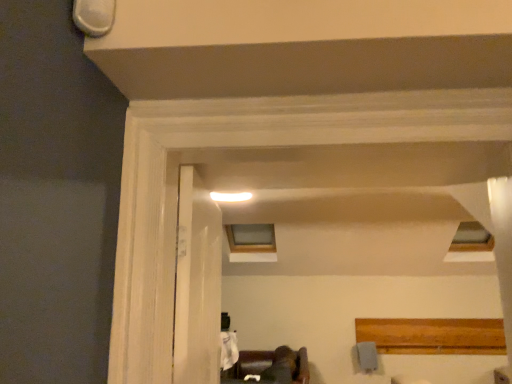
Question: Does white wood door at center have a lesser height compared to dark brown leather couch at lower center?

Choices:
 (A) yes
 (B) no

Answer: (B)

Question: Does white wood door at center have a greater height compared to dark brown leather couch at lower center?

Choices:
 (A) no
 (B) yes

Answer: (B)

Question: Would you say white wood door at center contains dark brown leather couch at lower center?

Choices:
 (A) yes
 (B) no

Answer: (B)

Question: From a real-world perspective, does white wood door at center sit lower than dark brown leather couch at lower center?

Choices:
 (A) yes
 (B) no

Answer: (B)

Question: Is white wood door at center smaller than dark brown leather couch at lower center?

Choices:
 (A) yes
 (B) no

Answer: (A)

Question: Considering the relative sizes of white wood door at center and dark brown leather couch at lower center in the image provided, is white wood door at center wider than dark brown leather couch at lower center?

Choices:
 (A) yes
 (B) no

Answer: (B)

Question: Considering the relative positions of white wood door at center and clear glass window at upper center in the image provided, is white wood door at center to the right of clear glass window at upper center from the viewer's perspective?

Choices:
 (A) yes
 (B) no

Answer: (B)

Question: Is the depth of white wood door at center greater than that of clear glass window at upper center?

Choices:
 (A) yes
 (B) no

Answer: (B)

Question: Can you confirm if white wood door at center is wider than clear glass window at upper center?

Choices:
 (A) no
 (B) yes

Answer: (A)

Question: Does white wood door at center have a larger size compared to clear glass window at upper center?

Choices:
 (A) no
 (B) yes

Answer: (A)

Question: From the image's perspective, is white wood door at center over clear glass window at upper center?

Choices:
 (A) no
 (B) yes

Answer: (B)

Question: From a real-world perspective, is white wood door at center under clear glass window at upper center?

Choices:
 (A) yes
 (B) no

Answer: (A)

Question: From a real-world perspective, is clear glass window at upper center physically above white wood door at center?

Choices:
 (A) no
 (B) yes

Answer: (B)